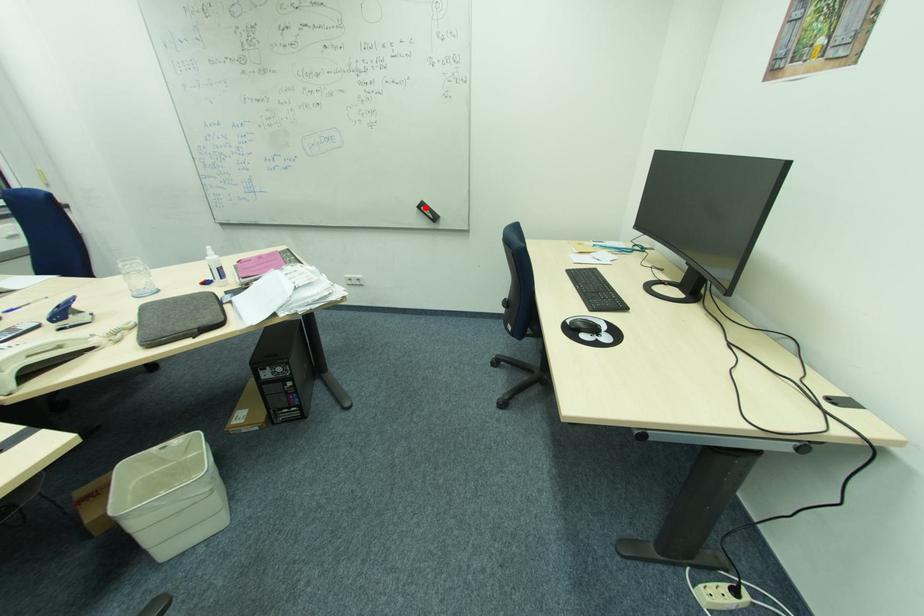
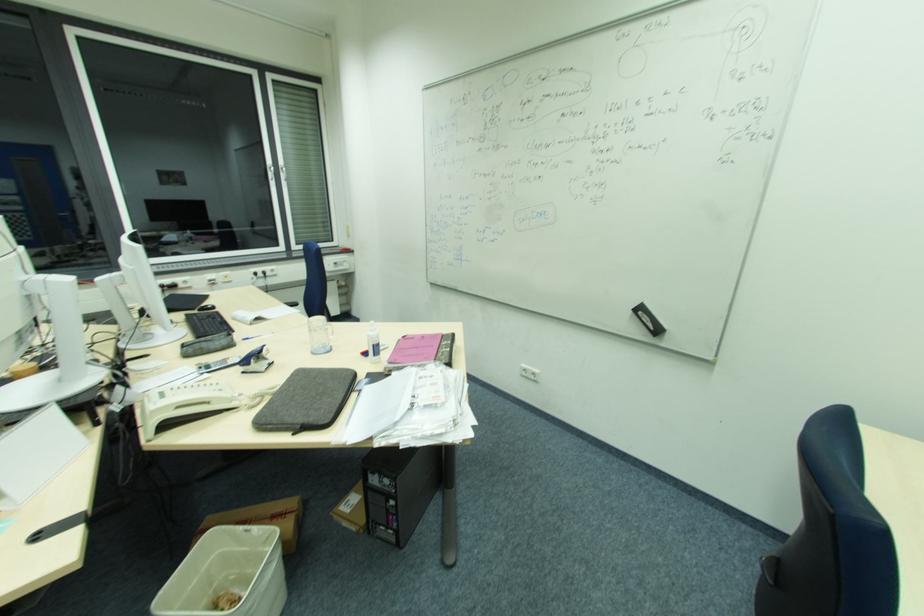
Question: I am providing you with two images of the same scene from different viewpoints. In image1, a red point is highlighted. Considering the same 3D point in image2, which of the following is correct?

Choices:
 (A) It is closer
 (B) It is farther

Answer: (B)